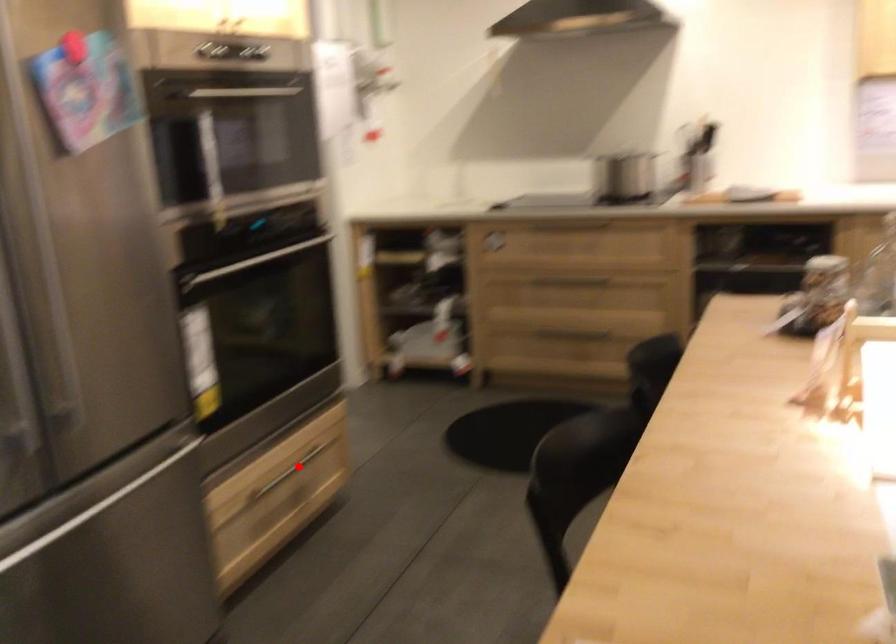
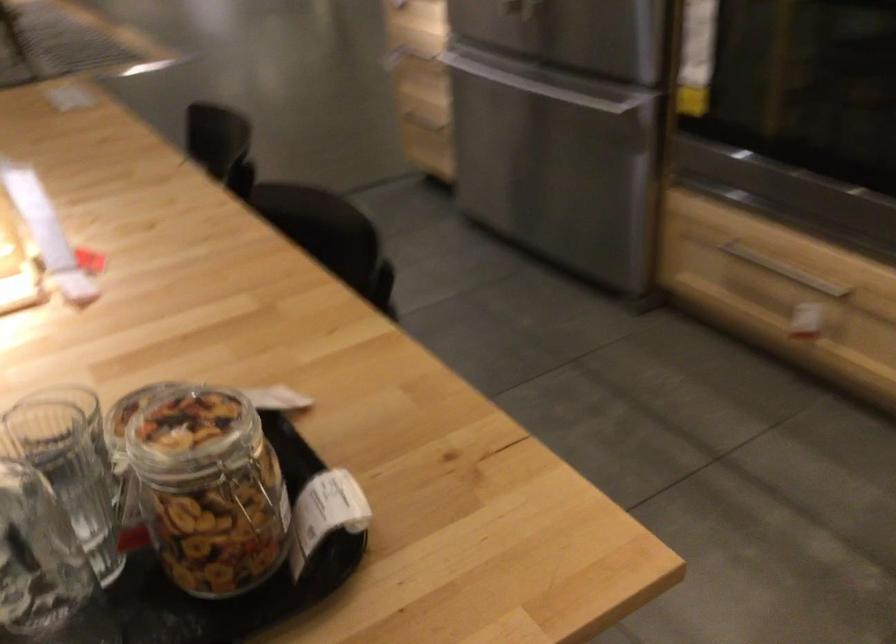
Question: I am providing you with two images of the same scene from different viewpoints. Given a red point in image1, look at the same physical point in image2. Is it:

Choices:
 (A) Closer to the viewpoint
 (B) Farther from the viewpoint

Answer: (A)